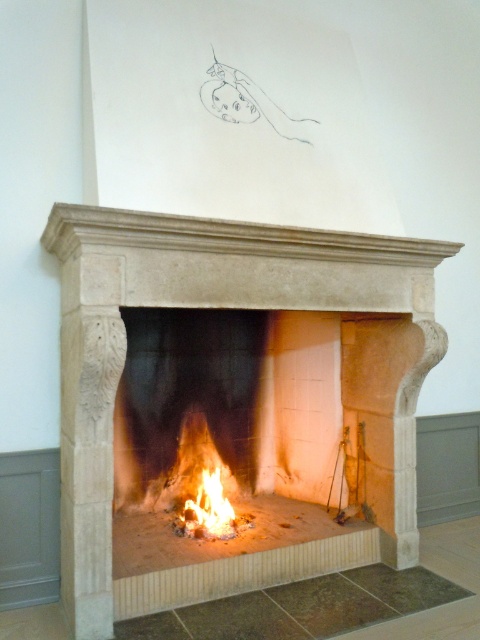
Looking at this image, you are a fire safety inspector checking the distance between the flaming wood at center and the flameflame at center in the fireplace. According to safety regulations, the minimum safe distance between any burning material and the flames should be at least 2 inches. Is the current distance compliant with the safety standards?

The distance between the flaming wood at center and the flameflame at center is 1.48 inches, which is less than the required 2 inches. Therefore, it does not comply with safety standards.

You are standing in the room and notice the beige stone fireplace at center and the flaming wood at center. Which object is positioned to the right side of the other?

The beige stone fireplace at center is to the right of the flaming wood at center.

Based on the photo, you are standing in the room with the beige stone fireplace at center. There is a point marked at coordinates (207, 307). Which object does this point correspond to?

The point at coordinates (207, 307) corresponds to the beige stone fireplace at center.